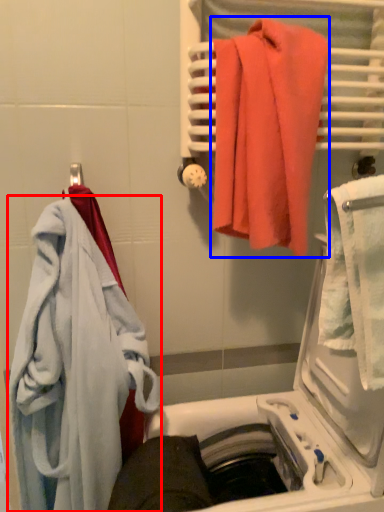
Question: Which point is closer to the camera, towel (highlighted by a red box) or towel (highlighted by a blue box)?

Choices:
 (A) towel
 (B) towel

Answer: (B)